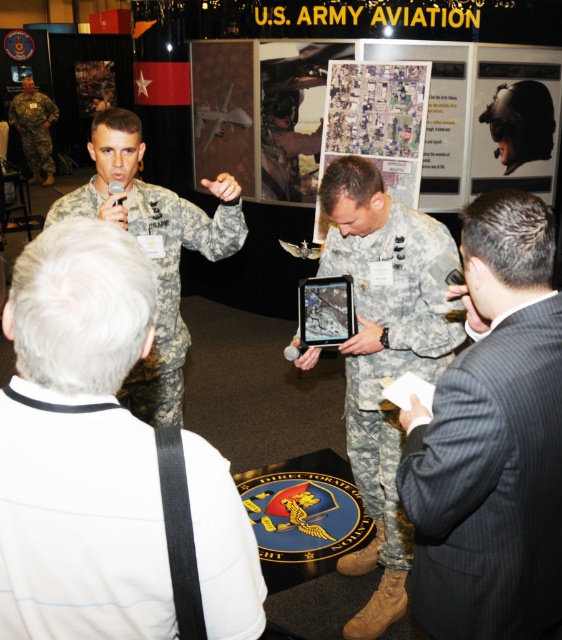
Question: Which of these objects is positioned closest to the black pinstripe suit at right?

Choices:
 (A) white fabric uniform at lower left
 (B) camouflage fabric uniform at left

Answer: (A)

Question: Which point is closer to the camera taking this photo?

Choices:
 (A) (43, 93)
 (B) (165, 301)
 (C) (409, 248)
 (D) (128, 428)

Answer: (D)

Question: Is black pinstripe suit at right behind camouflage uniform at left?

Choices:
 (A) no
 (B) yes

Answer: (A)

Question: Does camouflage fabric uniform at center appear under camouflage uniform at left?

Choices:
 (A) no
 (B) yes

Answer: (B)

Question: Which point is farther to the camera?

Choices:
 (A) (160, 349)
 (B) (38, 148)
 (C) (360, 312)
 (D) (536, 326)

Answer: (B)

Question: Does black pinstripe suit at right lie in front of camouflage uniform at left?

Choices:
 (A) no
 (B) yes

Answer: (B)